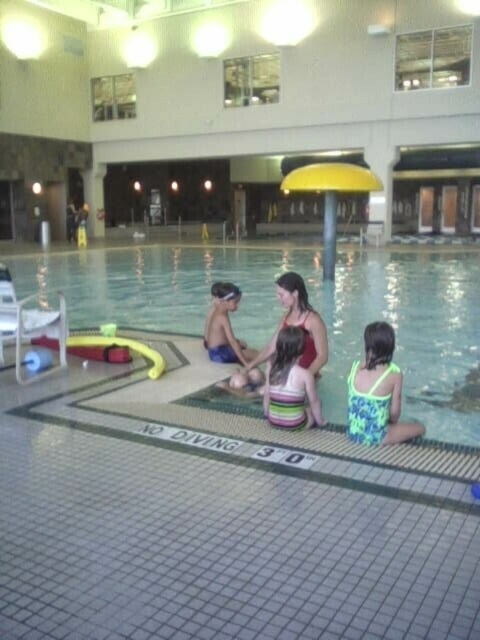
Is point (391, 321) behind point (236, 337)?

Yes, point (391, 321) is farther from viewer.

Between clear plastic pool at center and blue swim trunks at center, which one is positioned higher?

Positioned higher is clear plastic pool at center.

The height and width of the screenshot is (640, 480). Identify the location of clear plastic pool at center. (312, 304).

Consider the image. Can you confirm if matte red swimsuit at center is smaller than blue swim trunks at center?

No.

Can you confirm if matte red swimsuit at center is taller than blue swim trunks at center?

Correct, matte red swimsuit at center is much taller as blue swim trunks at center.

The image size is (480, 640). What do you see at coordinates (291, 324) in the screenshot?
I see `matte red swimsuit at center` at bounding box center [291, 324].

Identify the location of matte red swimsuit at center. The width and height of the screenshot is (480, 640). (291, 324).

This screenshot has height=640, width=480. In order to click on neon green swimsuit at lower right in this screenshot , I will do `click(377, 392)`.

Does point (377, 403) lie in front of point (277, 330)?

Yes.

The height and width of the screenshot is (640, 480). I want to click on neon green swimsuit at lower right, so click(377, 392).